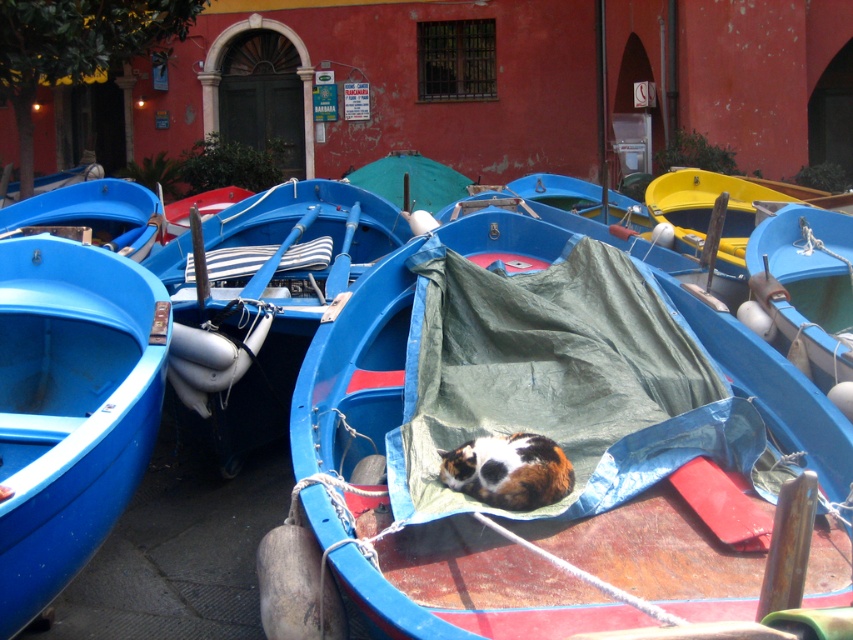
Question: Does matte blue boat at center appear on the right side of matte blue boat at left?

Choices:
 (A) yes
 (B) no

Answer: (A)

Question: Does matte blue boat at center appear on the left side of matte blue boat at left?

Choices:
 (A) yes
 (B) no

Answer: (B)

Question: Observing the image, what is the correct spatial positioning of matte blue boat at center in reference to matte blue boat at left?

Choices:
 (A) below
 (B) above

Answer: (A)

Question: Which point appears farthest from the camera in this image?

Choices:
 (A) (27, 269)
 (B) (567, 634)

Answer: (A)